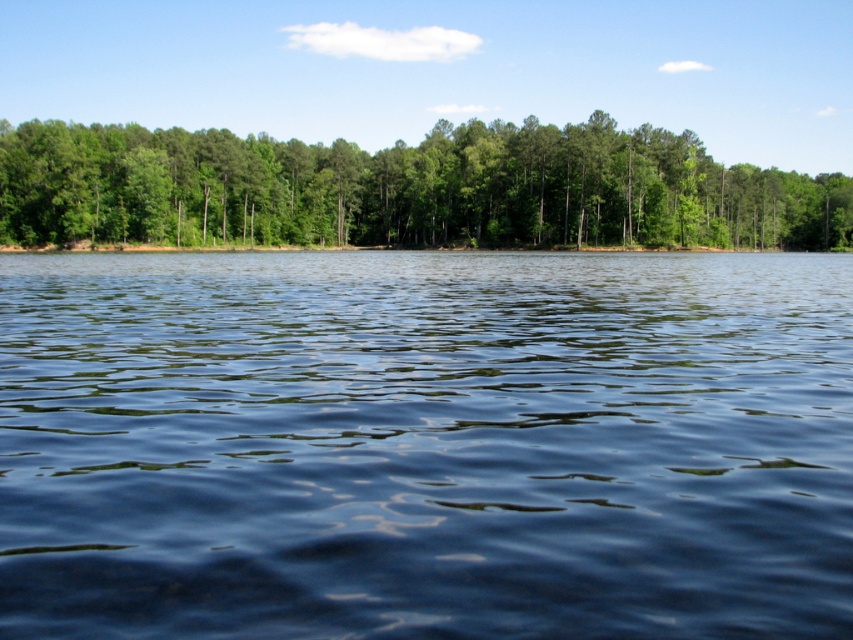
Question: Among these objects, which one is nearest to the camera?

Choices:
 (A) dark blue water at center
 (B) green leafy trees at center

Answer: (A)

Question: Does dark blue water at center have a lesser width compared to green leafy trees at center?

Choices:
 (A) no
 (B) yes

Answer: (B)

Question: Can you confirm if dark blue water at center is smaller than green leafy trees at center?

Choices:
 (A) yes
 (B) no

Answer: (A)

Question: Does dark blue water at center lie behind green leafy trees at center?

Choices:
 (A) yes
 (B) no

Answer: (B)